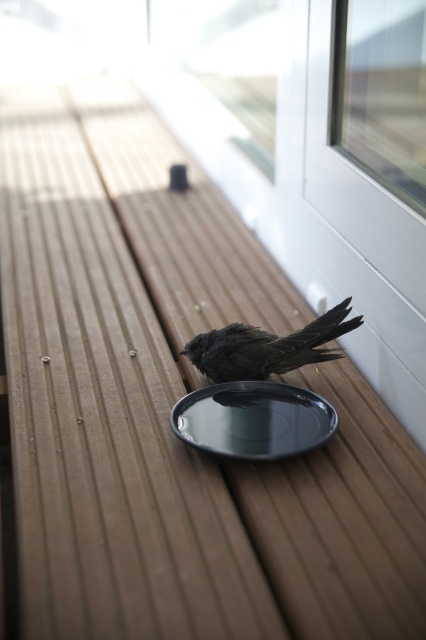
Question: Does shiny black plate at center appear under dark matte bird at center?

Choices:
 (A) yes
 (B) no

Answer: (A)

Question: Which point is farther to the camera?

Choices:
 (A) (261, 358)
 (B) (258, 419)

Answer: (A)

Question: Which object is closer to the camera taking this photo?

Choices:
 (A) shiny black plate at center
 (B) dark matte bird at center
 (C) transparent plastic screen door at upper right

Answer: (A)

Question: Is transparent plastic screen door at upper right to the left of dark matte bird at center from the viewer's perspective?

Choices:
 (A) no
 (B) yes

Answer: (A)

Question: From the image, what is the correct spatial relationship of transparent plastic screen door at upper right in relation to dark matte bird at center?

Choices:
 (A) above
 (B) below

Answer: (A)

Question: Which of the following is the farthest from the observer?

Choices:
 (A) (261, 337)
 (B) (334, 276)
 (C) (279, 413)

Answer: (B)